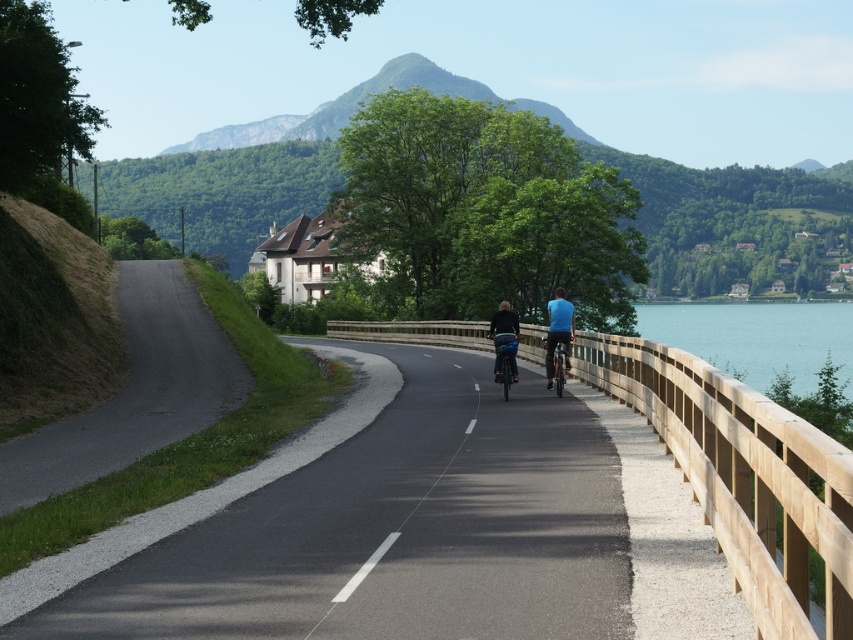
Question: Is blue fabric jacket at center to the right of orange matte bicycle at center from the viewer's perspective?

Choices:
 (A) no
 (B) yes

Answer: (A)

Question: Considering the relative positions of blue fabric jacket at center and metallic blue bicycle at center in the image provided, where is blue fabric jacket at center located with respect to metallic blue bicycle at center?

Choices:
 (A) left
 (B) right

Answer: (B)

Question: Which object appears farthest from the camera in this image?

Choices:
 (A) metallic blue bicycle at center
 (B) orange matte bicycle at center
 (C) blue fabric jacket at center
 (D) blue matte shirt at center

Answer: (D)

Question: Which object appears farthest from the camera in this image?

Choices:
 (A) blue fabric jacket at center
 (B) blue matte shirt at center
 (C) metallic blue bicycle at center

Answer: (B)

Question: Does blue matte shirt at center have a larger size compared to orange matte bicycle at center?

Choices:
 (A) no
 (B) yes

Answer: (B)

Question: Estimate the real-world distances between objects in this image. Which object is farther from the orange matte bicycle at center?

Choices:
 (A) metallic blue bicycle at center
 (B) blue fabric jacket at center
 (C) blue matte shirt at center

Answer: (B)